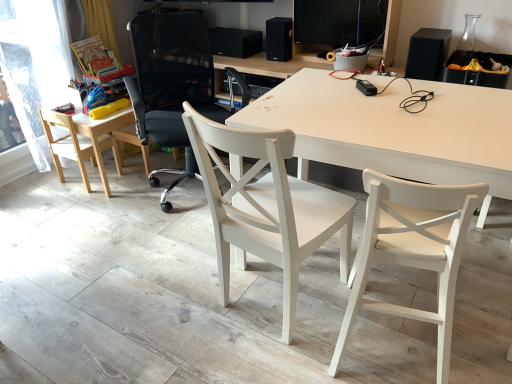
Find the location of `vacant space underneath white matte chair at center, the 1th chair positioned from the right (from a real-world perspective)`. vacant space underneath white matte chair at center, the 1th chair positioned from the right (from a real-world perspective) is located at coordinates 384,347.